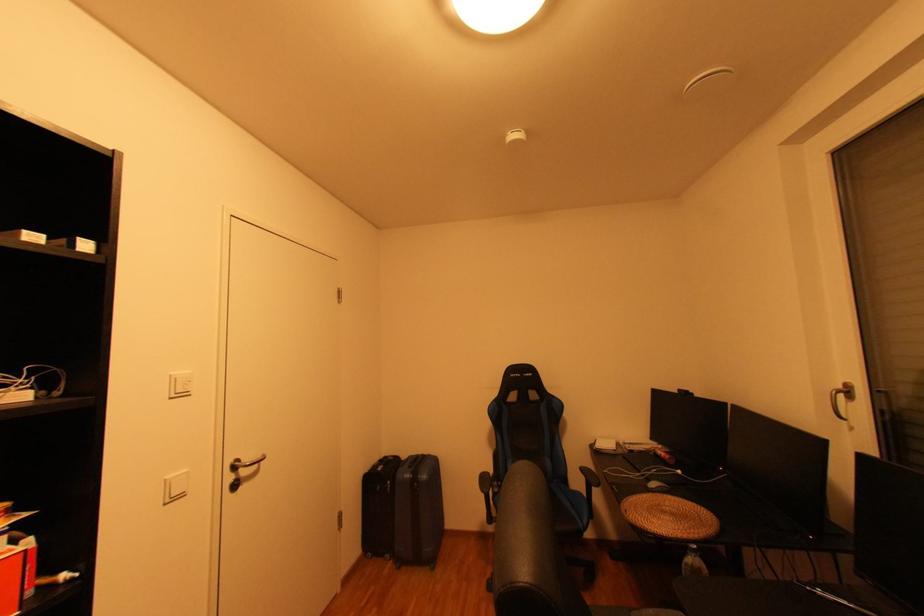
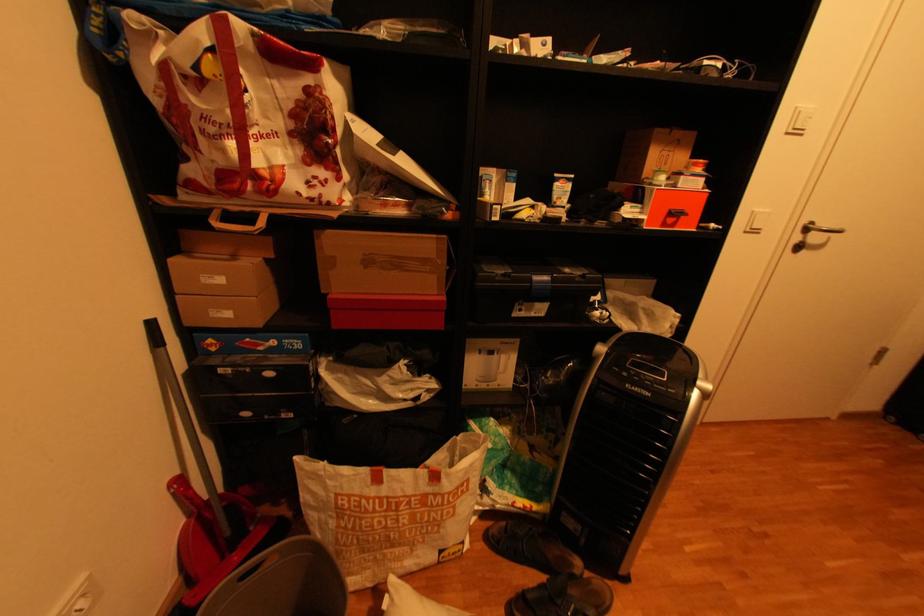
The point at (179, 399) is marked in the first image. Where is the corresponding point in the second image?

(796, 134)